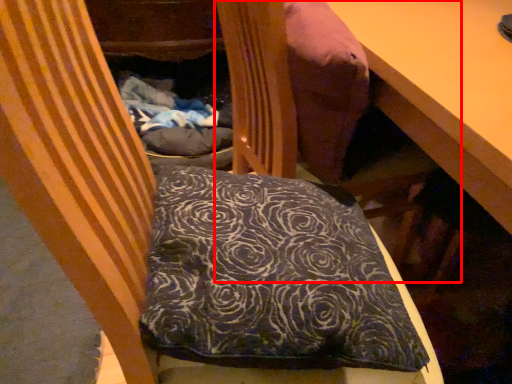
Question: From the image, what is the correct spatial relationship of bean bag chair (annotated by the red box) in relation to pillow?

Choices:
 (A) right
 (B) left

Answer: (A)